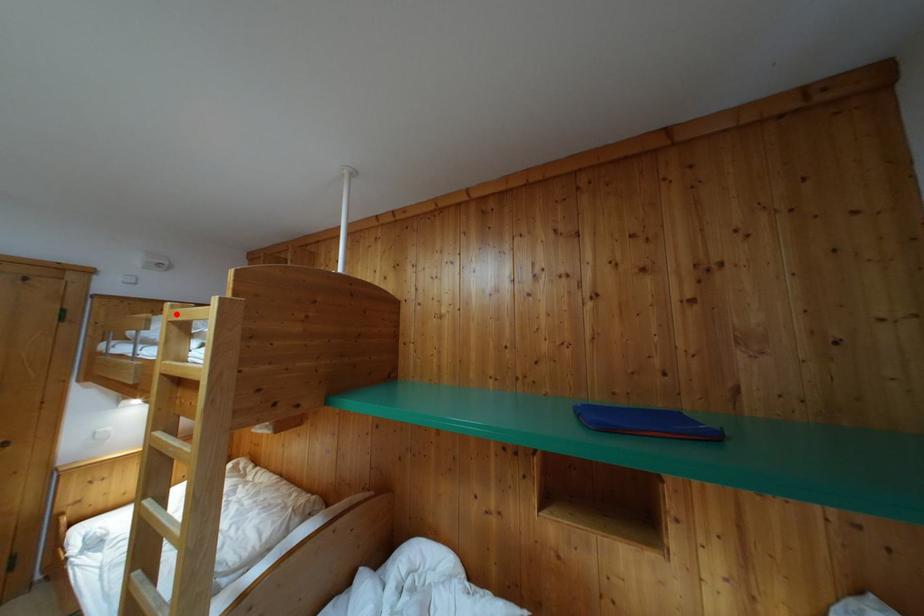
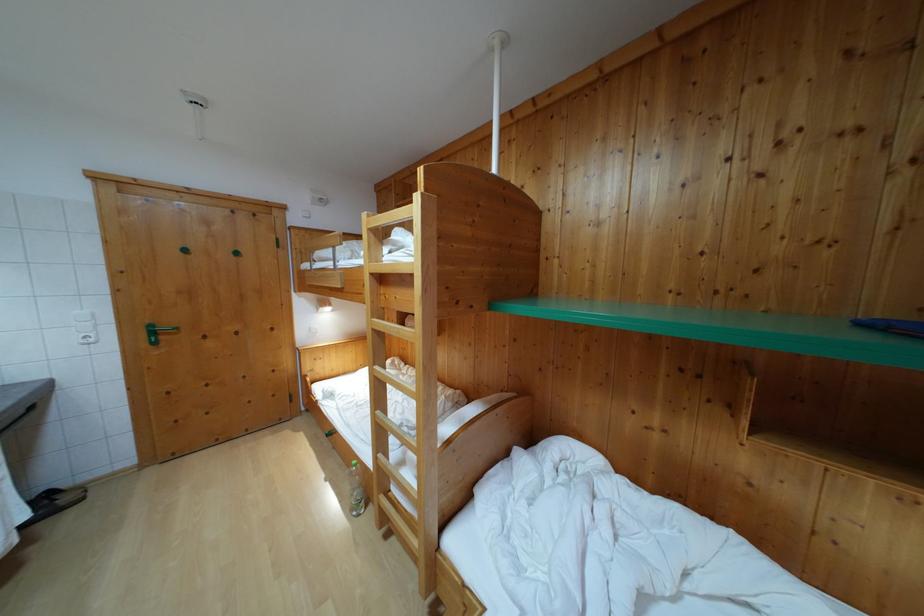
In the second image, find the point that corresponds to the highlighted location in the first image.

(371, 223)